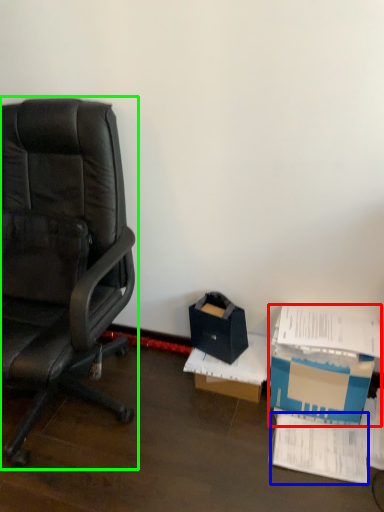
Question: Which object is positioned closest to box (highlighted by a red box)? Select from paperback book (highlighted by a blue box) and chair (highlighted by a green box).

Choices:
 (A) paperback book
 (B) chair

Answer: (A)